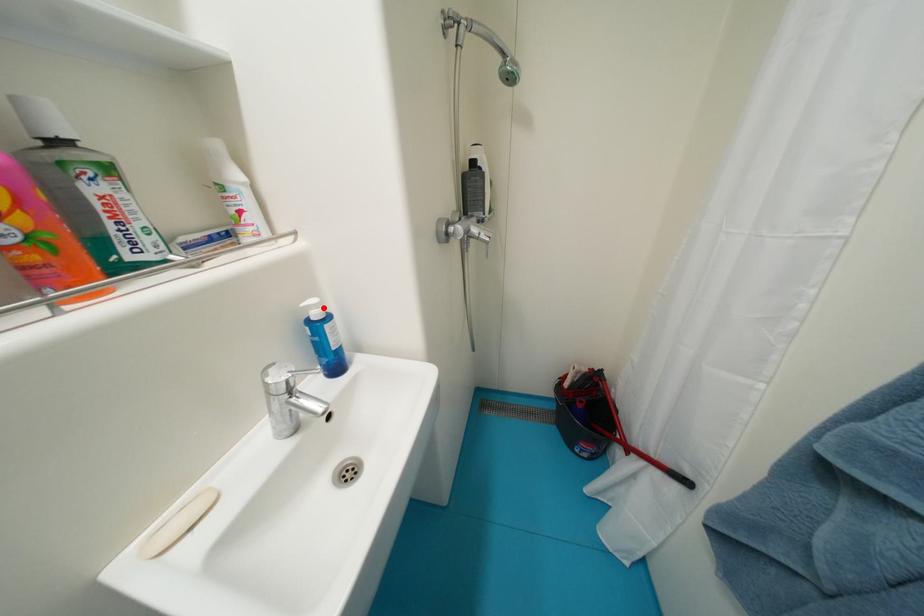
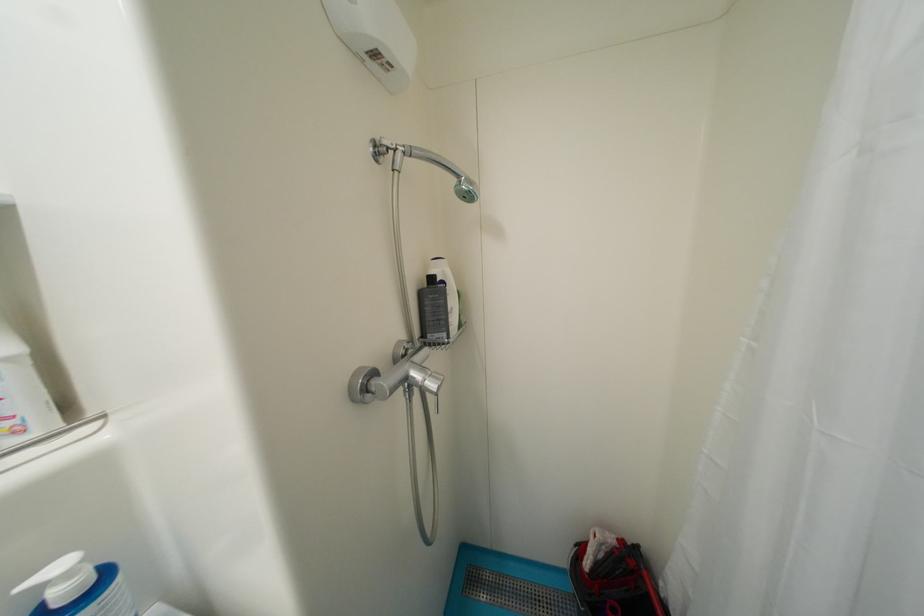
Find the pixel in the second image that matches the highlighted location in the first image.

(75, 576)